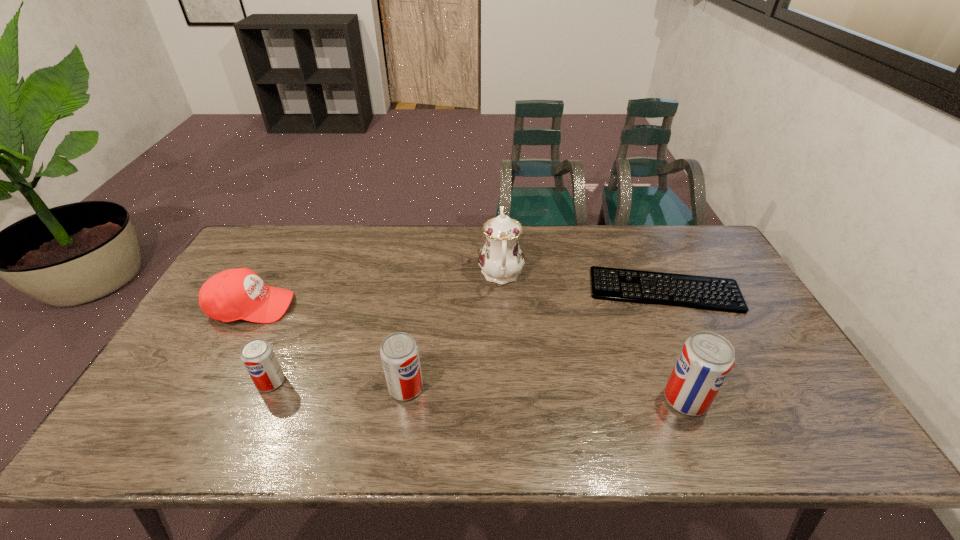
The width and height of the screenshot is (960, 540). In order to click on vacant space located 0.370m on the back of the fifth shortest object in this screenshot , I will do `click(638, 284)`.

Find the location of a particular element. This screenshot has width=960, height=540. vacant space located 0.250m on the front of the chinaware is located at coordinates (506, 364).

Where is `vacant space located on the front panel of the baseball cap`? Image resolution: width=960 pixels, height=540 pixels. vacant space located on the front panel of the baseball cap is located at coordinates (391, 306).

Identify the location of vacant point located on the back of the shortest object. The image size is (960, 540). (648, 254).

Where is `object positioned at the far edge`? The width and height of the screenshot is (960, 540). object positioned at the far edge is located at coordinates (501, 259).

Find the location of a particular element. This screenshot has width=960, height=540. object located at the left edge is located at coordinates (234, 294).

In order to click on object situated at the right edge in this screenshot , I will do `click(727, 293)`.

I want to click on vacant space at the far edge of the desktop, so click(624, 266).

Locate an element on the screen. Image resolution: width=960 pixels, height=540 pixels. vacant space at the near edge of the desktop is located at coordinates (258, 402).

Where is `free space at the right edge of the desktop`? The width and height of the screenshot is (960, 540). free space at the right edge of the desktop is located at coordinates click(745, 333).